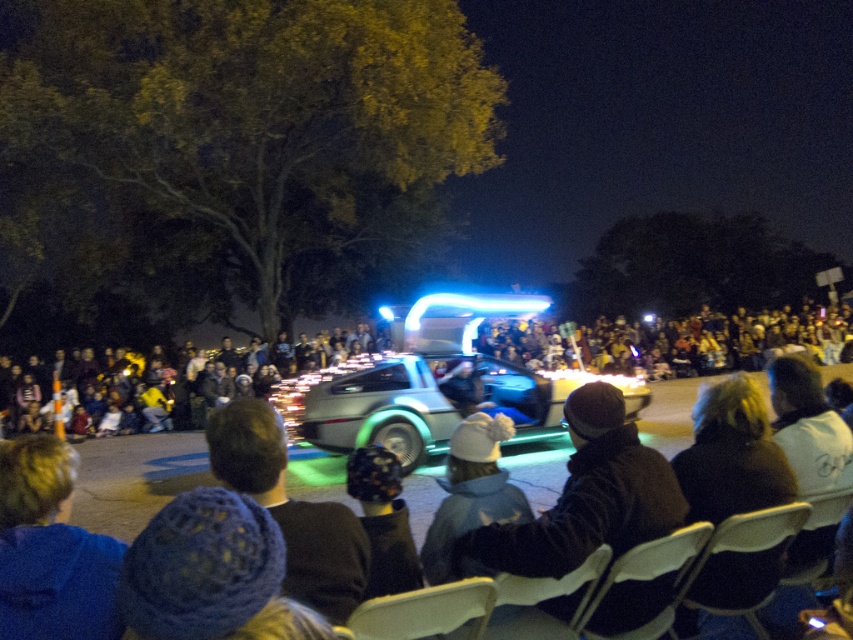
You are a photographer at the event and want to capture both the white cotton shirt at lower right and the white knit hat at center in a single frame. Since you can only focus on one subject at a time, which one should you focus on to ensure the other remains in the background?

You should focus on the white knit hat at center because the white cotton shirt at lower right is to the right of it, allowing the shirt to stay in the background if the hat is the main focus.

You are a photographer at the event and want to capture a photo of the silver metallic delorean at center and the white cotton shirt at lower right in the same frame. Considering their sizes, which object should you focus on first to ensure both are in focus?

The silver metallic delorean at center is much taller than the white cotton shirt at lower right. To ensure both are in focus, you should focus on the silver metallic delorean at center first since it is larger and farther away, allowing the smaller and closer white cotton shirt at lower right to fall within the depth of field.